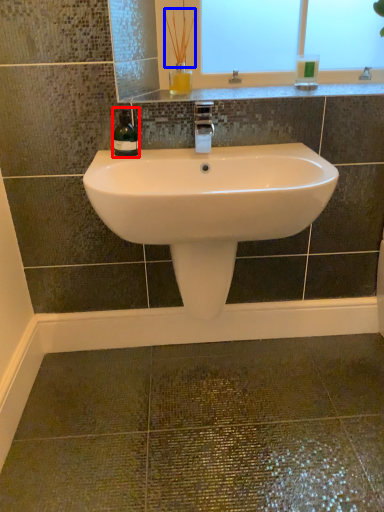
Question: Which object appears closest to the camera in this image, wine bottle (highlighted by a red box) or plant (highlighted by a blue box)?

Choices:
 (A) wine bottle
 (B) plant

Answer: (A)